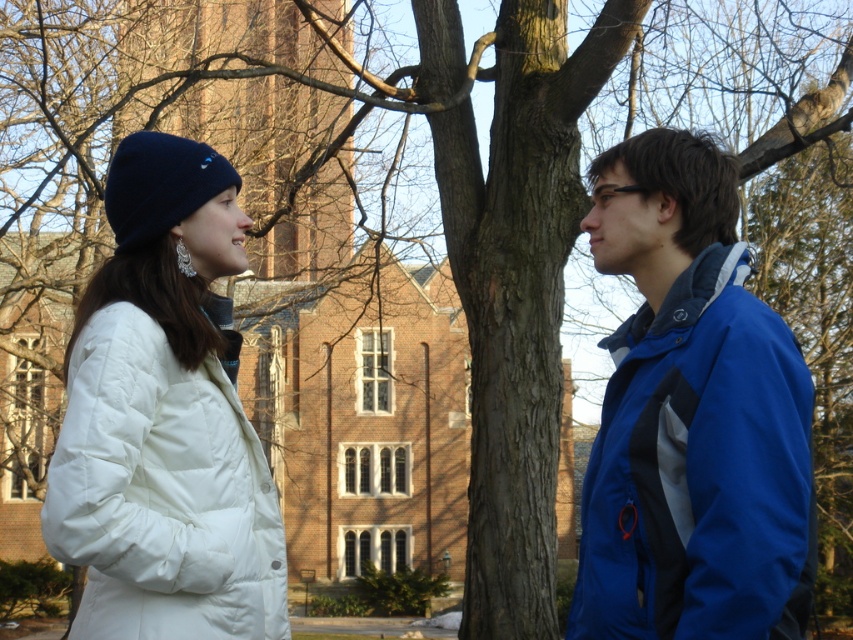
Question: Is blue softshell jacket at right closer to camera compared to white puffy coat at left?

Choices:
 (A) yes
 (B) no

Answer: (B)

Question: Can you confirm if blue softshell jacket at right is wider than white puffy coat at left?

Choices:
 (A) no
 (B) yes

Answer: (A)

Question: Which of the following is the farthest from the observer?

Choices:
 (A) white puffy coat at left
 (B) blue softshell jacket at right

Answer: (B)

Question: Can you confirm if blue softshell jacket at right is positioned to the left of white puffy coat at left?

Choices:
 (A) no
 (B) yes

Answer: (A)

Question: Which of the following is the closest to the observer?

Choices:
 (A) (194, 579)
 (B) (762, 483)

Answer: (B)

Question: Which point appears farthest from the camera in this image?

Choices:
 (A) (634, 529)
 (B) (128, 417)

Answer: (A)